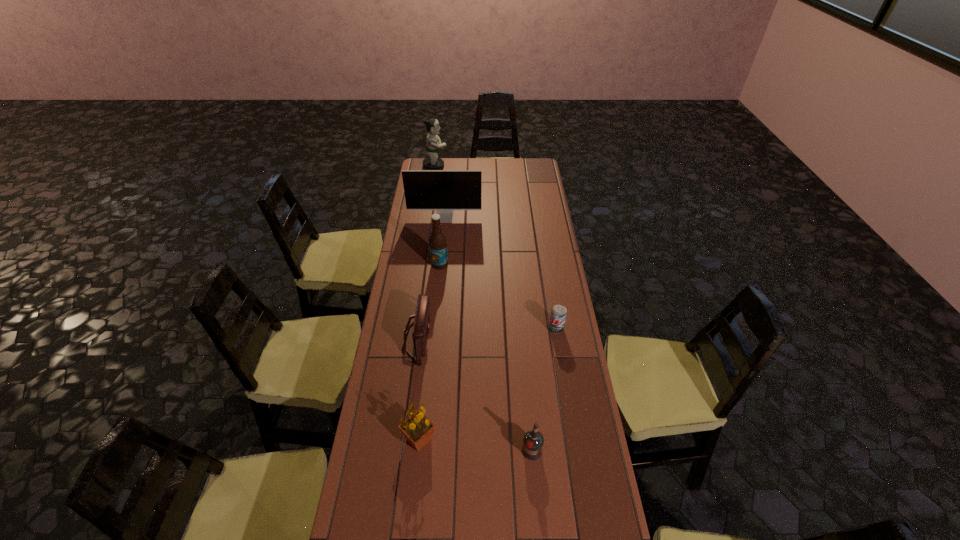
Find the location of a particular element. This screenshot has height=540, width=960. vacant region located 0.140m on the back of the fifth nearest object is located at coordinates [x=442, y=240].

At what (x,y) coordinates should I click in order to perform the action: click on free space located at the front of the sunflower with flowers visible. Please return your answer as a coordinate pair (x, y). Looking at the image, I should click on (492, 439).

What are the coordinates of `vacant space located 0.070m on the front label of the vodka` in the screenshot? It's located at (535, 483).

The image size is (960, 540). Find the location of `vacant region located 0.130m on the front flap of the shoulder bag`. vacant region located 0.130m on the front flap of the shoulder bag is located at coordinates (464, 337).

Locate an element on the screen. The width and height of the screenshot is (960, 540). free space located on the left of the shortest object is located at coordinates (509, 328).

This screenshot has width=960, height=540. In order to click on object located at the far edge in this screenshot , I will do `click(433, 142)`.

What are the coordinates of `figurine at the left edge` in the screenshot? It's located at (433, 142).

Identify the location of monitor that is at the left edge. The width and height of the screenshot is (960, 540). (443, 190).

Identify the location of beer bottle at the left edge. (437, 242).

The width and height of the screenshot is (960, 540). I want to click on sunflower at the left edge, so click(x=417, y=428).